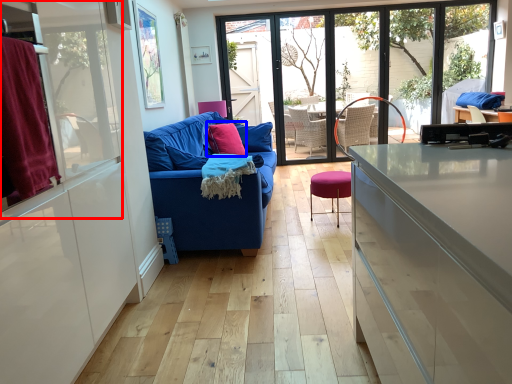
Question: Which point is closer to the camera, window screen (highlighted by a red box) or pillow (highlighted by a blue box)?

Choices:
 (A) window screen
 (B) pillow

Answer: (A)